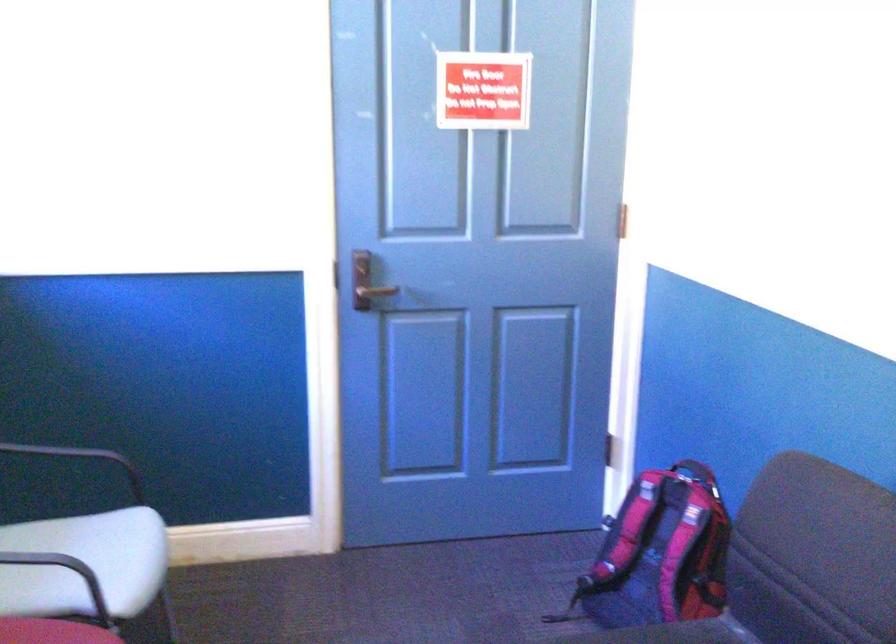
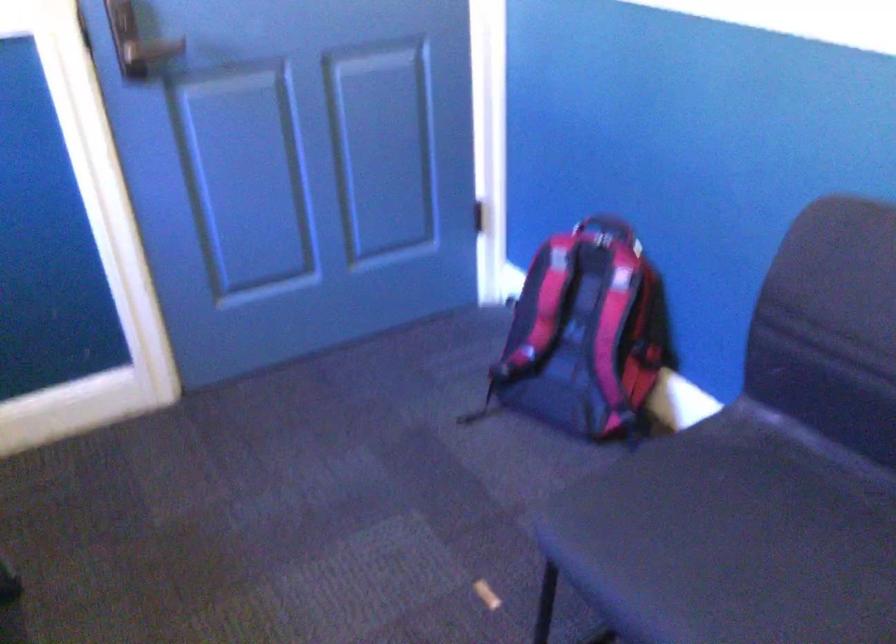
Where in the second image is the point corresponding to (x=367, y=292) from the first image?

(152, 50)